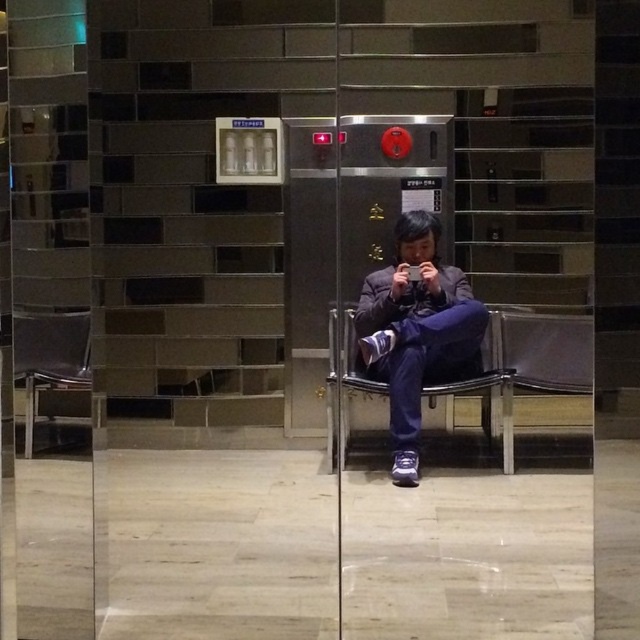
You are a GUI agent. You are given a task and a screenshot of the screen. Output one action in this format:
    pyautogui.click(x=<x>, y=<y>)
    Task: Click on the transparent glass door at center
    
    Given the screenshot: What is the action you would take?
    pyautogui.click(x=484, y=349)

Which is behind, point (508, 0) or point (419, 272)?

The point (419, 272) is more distant.

Locate an element on the screen. transparent glass door at center is located at coordinates (484, 349).

Is point (348, 40) positioned after point (17, 323)?

Yes.

Can you confirm if transparent glass door at center is positioned to the left of metallic silver chair at left?

In fact, transparent glass door at center is to the right of metallic silver chair at left.

Who is more distant from viewer, (461, 561) or (72, 330)?

The point (461, 561) is behind.

Find the location of a particular element. This screenshot has height=640, width=640. transparent glass door at center is located at coordinates (484, 349).

Is point (502, 0) farther from viewer compared to point (356, 301)?

That is False.

You are a GUI agent. You are given a task and a screenshot of the screen. Output one action in this format:
    pyautogui.click(x=<x>, y=<y>)
    Task: Click on the transparent glass door at center
    This screenshot has height=640, width=640.
    Given the screenshot: What is the action you would take?
    pyautogui.click(x=484, y=349)

You are a GUI agent. You are given a task and a screenshot of the screen. Output one action in this format:
    pyautogui.click(x=<x>, y=<y>)
    Task: Click on the transparent glass door at center
    The height and width of the screenshot is (640, 640).
    Given the screenshot: What is the action you would take?
    pyautogui.click(x=484, y=349)